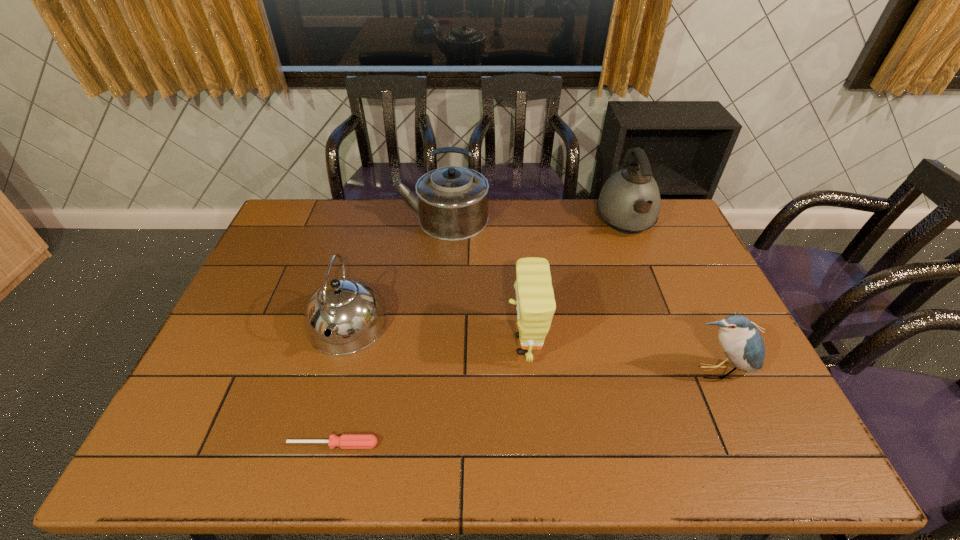
The image size is (960, 540). Find the location of `the rightmost kettle`. the rightmost kettle is located at coordinates (629, 202).

Find the location of a particular element. The height and width of the screenshot is (540, 960). sponge is located at coordinates (535, 301).

Where is `the nearest kettle`? The width and height of the screenshot is (960, 540). the nearest kettle is located at coordinates (343, 316).

I want to click on bird, so click(742, 343).

The height and width of the screenshot is (540, 960). What are the coordinates of `screwdriver` in the screenshot? It's located at (346, 441).

At what (x,y) coordinates should I click in order to perform the action: click on the shortest object. Please return your answer as a coordinate pair (x, y). Looking at the image, I should click on (346, 441).

Where is `vacant space located 0.070m at the spout of the rightmost kettle`? Image resolution: width=960 pixels, height=540 pixels. vacant space located 0.070m at the spout of the rightmost kettle is located at coordinates [x=642, y=262].

Where is `vacant space located on the face of the sponge`? The height and width of the screenshot is (540, 960). vacant space located on the face of the sponge is located at coordinates (408, 345).

Find the location of a particular element. This screenshot has width=960, height=540. vacant region located on the face of the sponge is located at coordinates (441, 345).

Identify the location of free location located 0.270m on the face of the sponge. This screenshot has width=960, height=540. (408, 345).